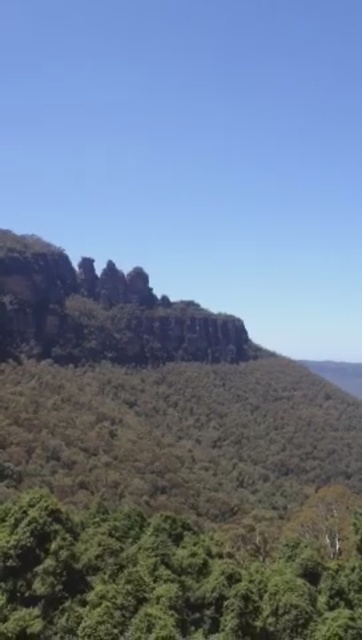
You are a hiker planning to climb the rocky cliff at center and the green leafy tree at lower center. Which one is taller?

The rocky cliff at center is taller than the green leafy tree at lower center.

You are an environmental scientist assessing the stability of the rocky cliff at center and the green leafy tree at lower center. Considering their widths, which one is more likely to provide a stable foundation for a small research station?

The rocky cliff at center has a larger width than the green leafy tree at lower center, making it more stable and suitable for a small research station.

Based on the photo, you are a hiker standing at the base of the rocky cliff at center and want to reach the green leafy tree at lower center. Given that your average walking pace is 3 miles per hour, how long will it take you to walk directly to the tree?

The rocky cliff at center is 229.61 feet away from the green leafy tree at lower center. Converting feet to miles, 229.61 feet is approximately 0.043 miles. At a walking pace of 3 miles per hour, it would take roughly 0.86 minutes, or about 52 seconds to reach the tree.